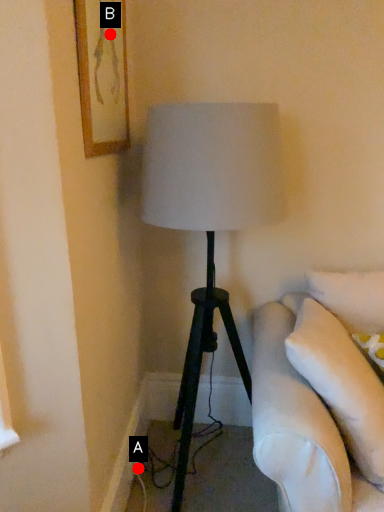
Question: Two points are circled on the image, labeled by A and B beside each circle. Which point is farther to the camera?

Choices:
 (A) A is further
 (B) B is further

Answer: (A)